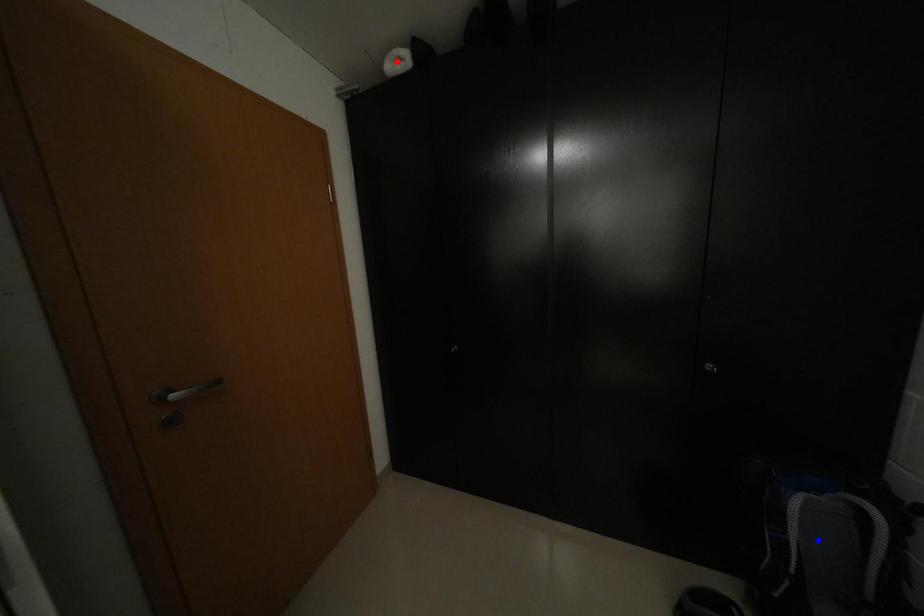
Question: Which of the two points in the image is closer to the camera?

Choices:
 (A) Blue point is closer.
 (B) Red point is closer.

Answer: (A)